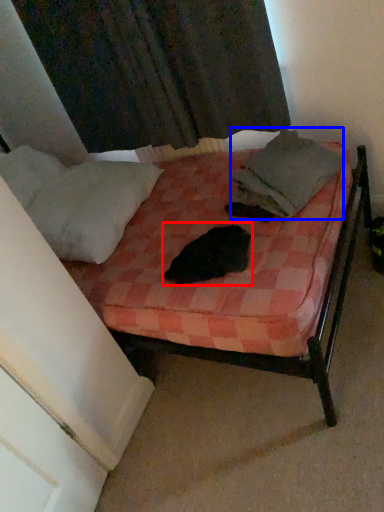
Question: Which of the following is the closest to the observer, animal (highlighted by a red box) or blanket (highlighted by a blue box)?

Choices:
 (A) animal
 (B) blanket

Answer: (A)